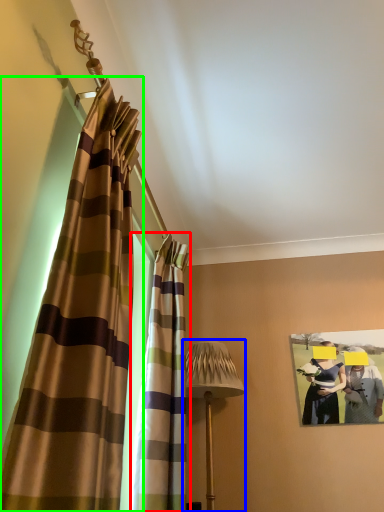
Question: Which object is positioned closest to curtain (highlighted by a red box)? Select from table lamp (highlighted by a blue box) and curtain (highlighted by a green box).

Choices:
 (A) table lamp
 (B) curtain

Answer: (A)